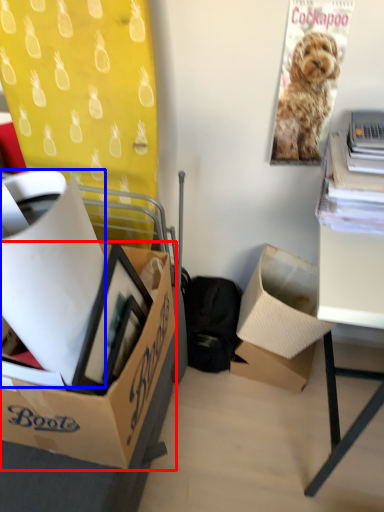
Question: Among these objects, which one is nearest to the camera, box (highlighted by a red box) or box (highlighted by a blue box)?

Choices:
 (A) box
 (B) box

Answer: (B)